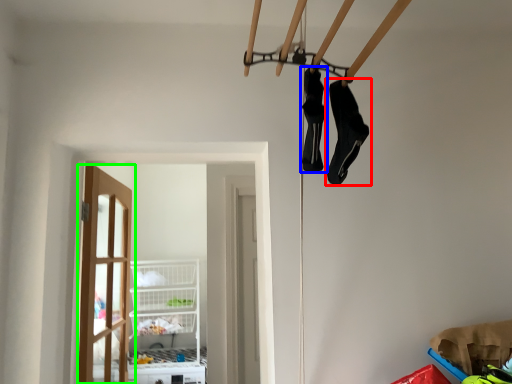
Question: Which object is the farthest from footwear (highlighted by a red box)? Choose among these: footwear (highlighted by a blue box) or door (highlighted by a green box).

Choices:
 (A) footwear
 (B) door

Answer: (B)